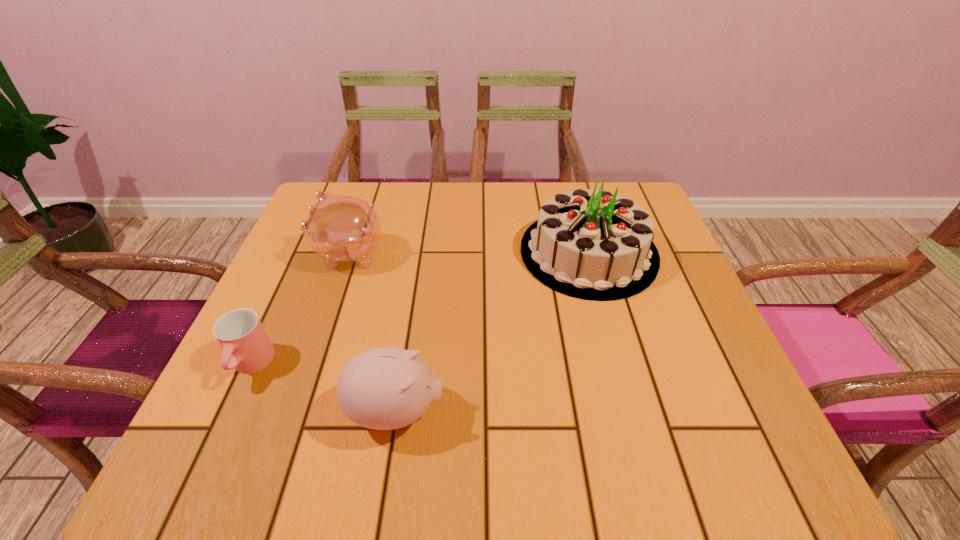
Locate an element on the screen. The width and height of the screenshot is (960, 540). free space between the tallest object and the taller piggy bank is located at coordinates (468, 253).

Identify the location of free space between the tallest object and the third tallest object. (492, 332).

In order to click on object that ranks as the third closest to the taller piggy bank in this screenshot , I will do `click(590, 244)`.

Locate which object is the second closest to the third shortest object. Please provide its 2D coordinates. Your answer should be formatted as a tuple, i.e. [(x, y)], where the tuple contains the x and y coordinates of a point satisfying the conditions above.

[(386, 388)]

I want to click on vacant space that satisfies the following two spatial constraints: 1. on the front facing side of the farther piggy bank; 2. on the side of the shortest object with the handle, so click(311, 365).

Find the location of a particular element. Image resolution: width=960 pixels, height=540 pixels. free location that satisfies the following two spatial constraints: 1. on the front facing side of the second tallest object; 2. on the side of the cup with the handle is located at coordinates (311, 365).

Image resolution: width=960 pixels, height=540 pixels. Find the location of `free space that satisfies the following two spatial constraints: 1. on the front side of the birthday cake; 2. on the front facing side of the farther piggy bank`. free space that satisfies the following two spatial constraints: 1. on the front side of the birthday cake; 2. on the front facing side of the farther piggy bank is located at coordinates (589, 254).

I want to click on free space that satisfies the following two spatial constraints: 1. on the front side of the birthday cake; 2. at the snout of the second shortest object, so click(x=633, y=411).